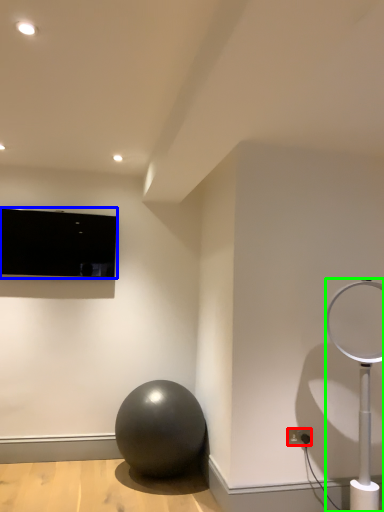
Question: Which is farther away from electric outlet (highlighted by a red box)? television (highlighted by a blue box) or lamp (highlighted by a green box)?

Choices:
 (A) television
 (B) lamp

Answer: (A)